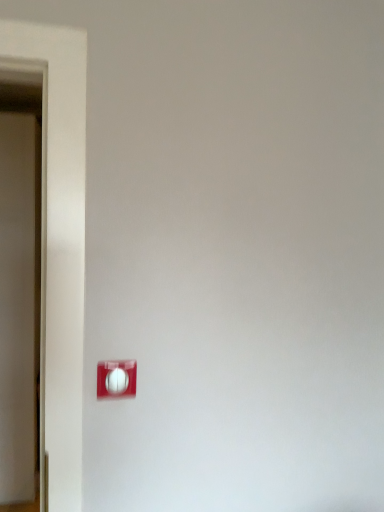
Locate an element on the screen. white plastic light switch at lower left is located at coordinates (116, 378).

The height and width of the screenshot is (512, 384). What do you see at coordinates (116, 378) in the screenshot?
I see `white plastic light switch at lower left` at bounding box center [116, 378].

Find the location of `white plastic light switch at lower left`. white plastic light switch at lower left is located at coordinates (116, 378).